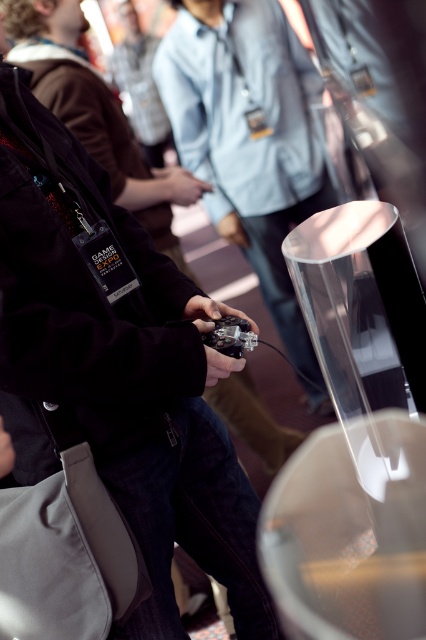
Question: In this image, where is matte black jacket at center located relative to metallic black game controller at center?

Choices:
 (A) below
 (B) above

Answer: (B)

Question: Is the position of matte black jacket at center less distant than that of metallic black game controller at center?

Choices:
 (A) yes
 (B) no

Answer: (B)

Question: Does matte black jacket at center lie in front of metallic black game controller at center?

Choices:
 (A) no
 (B) yes

Answer: (A)